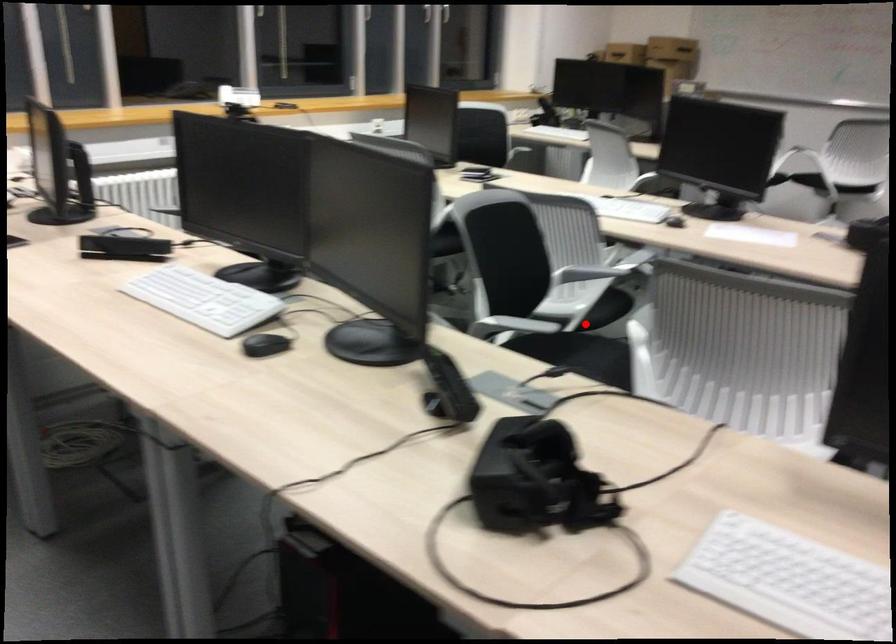
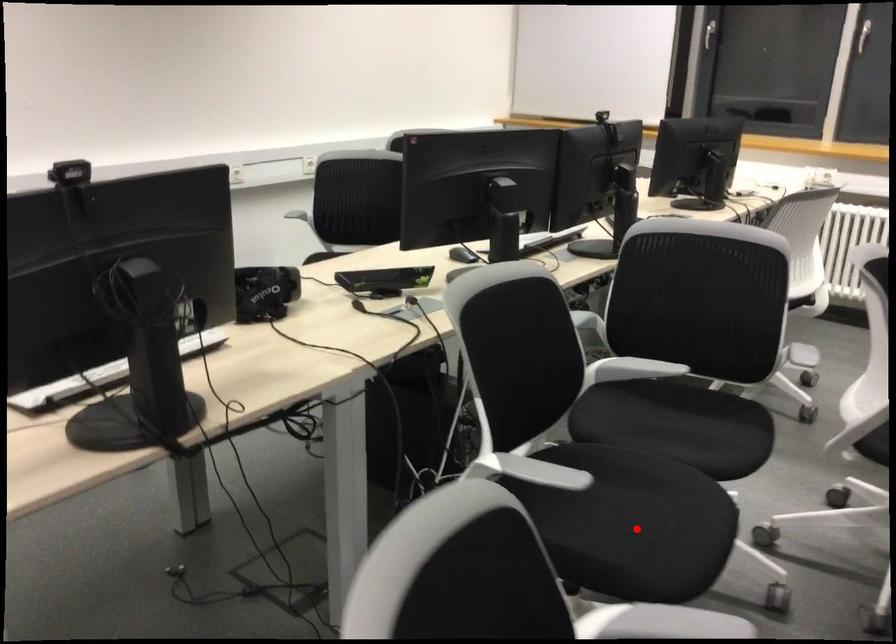
I am providing you with two images of the same scene from different viewpoints. A red point is marked on the first image and another point is marked on the second image. Are the points marked in image1 and image2 representing the same 3D position?

No